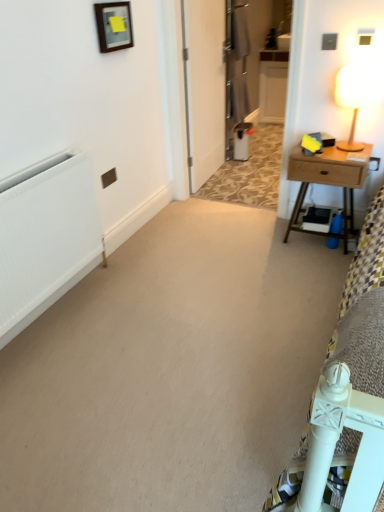
Question: From a real-world perspective, is wooden frame at upper center physically located above or below white matte radiator at left?

Choices:
 (A) above
 (B) below

Answer: (A)

Question: Would you say wooden frame at upper center is to the left or to the right of white matte radiator at left in the picture?

Choices:
 (A) right
 (B) left

Answer: (A)

Question: Considering the real-world distances, which object is farthest from the wooden table lamp at upper right?

Choices:
 (A) white matte radiator at left
 (B) metallic gray armoire at center
 (C) wooden nightstand at right
 (D) wooden frame at upper center

Answer: (B)

Question: Estimate the real-world distances between objects in this image. Which object is farther from the wooden nightstand at right?

Choices:
 (A) wooden frame at upper center
 (B) white matte radiator at left
 (C) metallic gray armoire at center
 (D) wooden table lamp at upper right

Answer: (C)